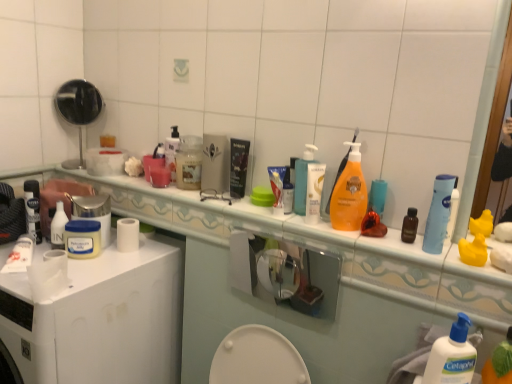
Where is `free spot to the left of orange plastic bottle at center, arranged as the 2th cleaning product when viewed from the left`? The width and height of the screenshot is (512, 384). free spot to the left of orange plastic bottle at center, arranged as the 2th cleaning product when viewed from the left is located at coordinates (274, 217).